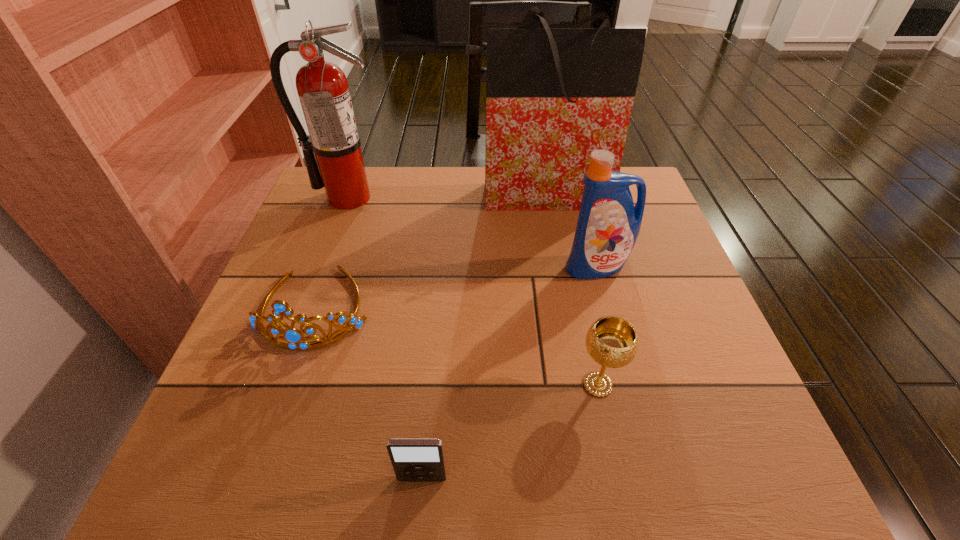
At what (x,y) coordinates should I click in order to perform the action: click on shopping bag. Please return your answer as a coordinate pair (x, y). The image size is (960, 540). Looking at the image, I should click on (553, 95).

Find the location of `fire extinguisher`. fire extinguisher is located at coordinates (x=322, y=87).

Where is `the third tallest object`? The image size is (960, 540). the third tallest object is located at coordinates (608, 225).

Where is `chalice`? This screenshot has height=540, width=960. chalice is located at coordinates (611, 341).

Where is `tiara`? The height and width of the screenshot is (540, 960). tiara is located at coordinates (292, 335).

Where is `iPod`? iPod is located at coordinates (413, 459).

Where is `the nearest object`? the nearest object is located at coordinates (413, 459).

Locate an element on the screen. The image size is (960, 540). vacant space situated on the front side of the shopping bag is located at coordinates (560, 330).

Find the location of a particular element. Image resolution: width=960 pixels, height=540 pixels. vacant space located 0.330m on the nozzle side of the fire extinguisher is located at coordinates (309, 303).

Locate an element on the screen. This screenshot has width=960, height=540. free space located 0.130m on the label of the detergent is located at coordinates pyautogui.click(x=613, y=326).